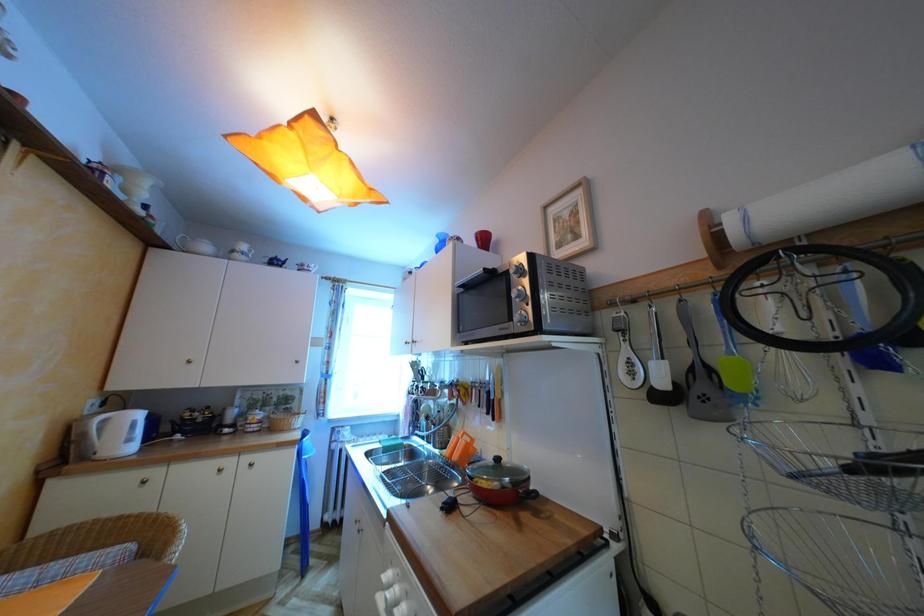
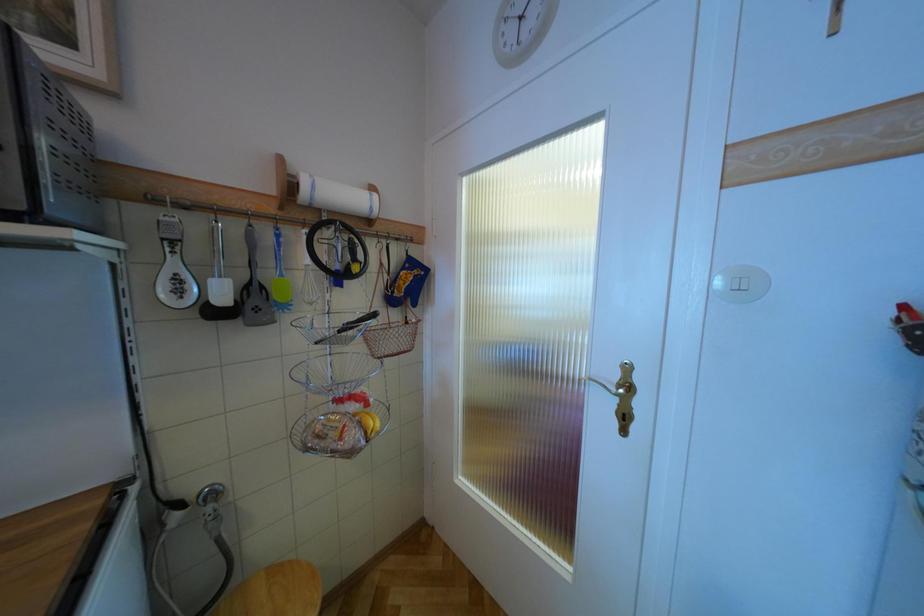
Question: The camera is either moving clockwise (left) or counter-clockwise (right) around the object. The first image is from the beginning of the video and the second image is from the end. Is the camera moving left or right when shooting the video?

Choices:
 (A) Left
 (B) Right

Answer: (A)